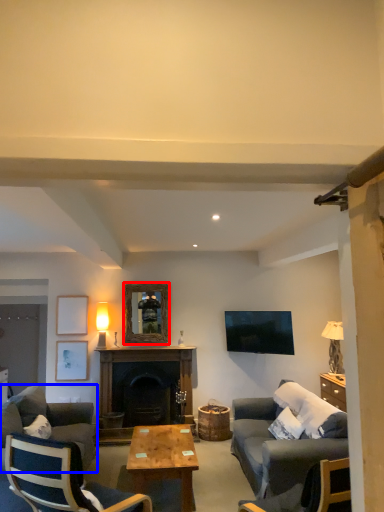
Question: Among these objects, which one is nearest to the camera, picture frame (highlighted by a red box) or studio couch (highlighted by a blue box)?

Choices:
 (A) picture frame
 (B) studio couch

Answer: (B)